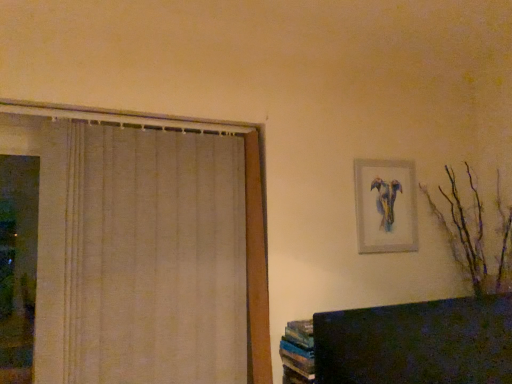
Question: Is beige fabric curtain at left far away from matte silver picture frame at upper right?

Choices:
 (A) yes
 (B) no

Answer: (B)

Question: Does beige fabric curtain at left have a greater width compared to matte silver picture frame at upper right?

Choices:
 (A) no
 (B) yes

Answer: (B)

Question: Does beige fabric curtain at left have a smaller size compared to matte silver picture frame at upper right?

Choices:
 (A) yes
 (B) no

Answer: (B)

Question: Considering the relative positions of beige fabric curtain at left and matte silver picture frame at upper right in the image provided, is beige fabric curtain at left to the left of matte silver picture frame at upper right from the viewer's perspective?

Choices:
 (A) no
 (B) yes

Answer: (B)

Question: Is beige fabric curtain at left positioned with its back to matte silver picture frame at upper right?

Choices:
 (A) no
 (B) yes

Answer: (A)

Question: Looking at their shapes, would you say brown matte branches at right is wider or thinner than matte silver picture frame at upper right?

Choices:
 (A) thin
 (B) wide

Answer: (B)

Question: From a real-world perspective, is brown matte branches at right physically located above or below matte silver picture frame at upper right?

Choices:
 (A) above
 (B) below

Answer: (B)

Question: Is point coord(471,264) closer or farther from the camera than point coord(394,182)?

Choices:
 (A) farther
 (B) closer

Answer: (A)

Question: Is brown matte branches at right in front of or behind matte silver picture frame at upper right in the image?

Choices:
 (A) behind
 (B) front

Answer: (B)

Question: Is beige fabric curtain at left bigger or smaller than brown matte branches at right?

Choices:
 (A) small
 (B) big

Answer: (A)

Question: Relative to brown matte branches at right, is beige fabric curtain at left in front or behind?

Choices:
 (A) front
 (B) behind

Answer: (A)

Question: In terms of height, does beige fabric curtain at left look taller or shorter compared to brown matte branches at right?

Choices:
 (A) short
 (B) tall

Answer: (A)

Question: Is beige fabric curtain at left to the left or to the right of brown matte branches at right in the image?

Choices:
 (A) right
 (B) left

Answer: (B)

Question: In terms of size, does matte silver picture frame at upper right appear bigger or smaller than brown matte branches at right?

Choices:
 (A) small
 (B) big

Answer: (A)

Question: Is point (404, 213) positioned closer to the camera than point (509, 248)?

Choices:
 (A) farther
 (B) closer

Answer: (B)